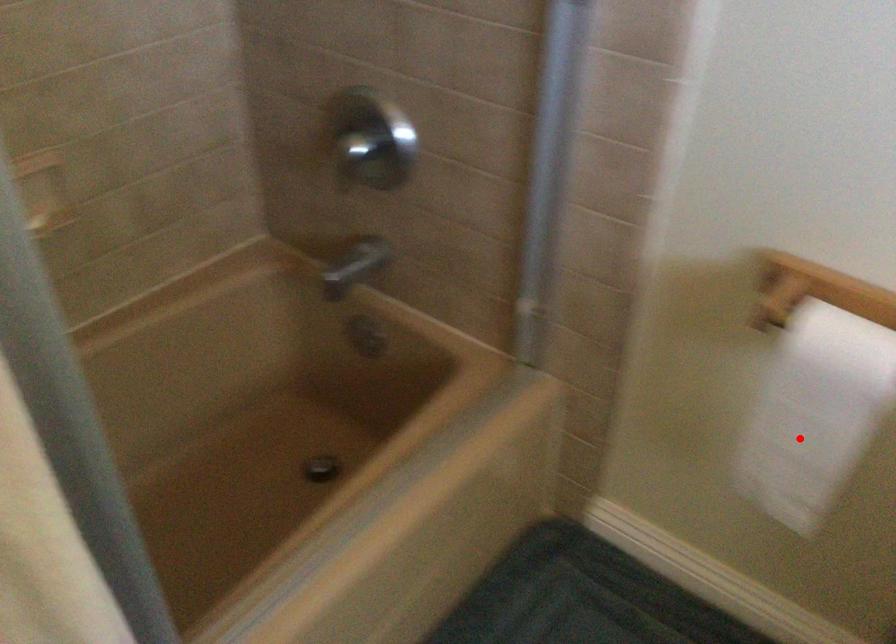
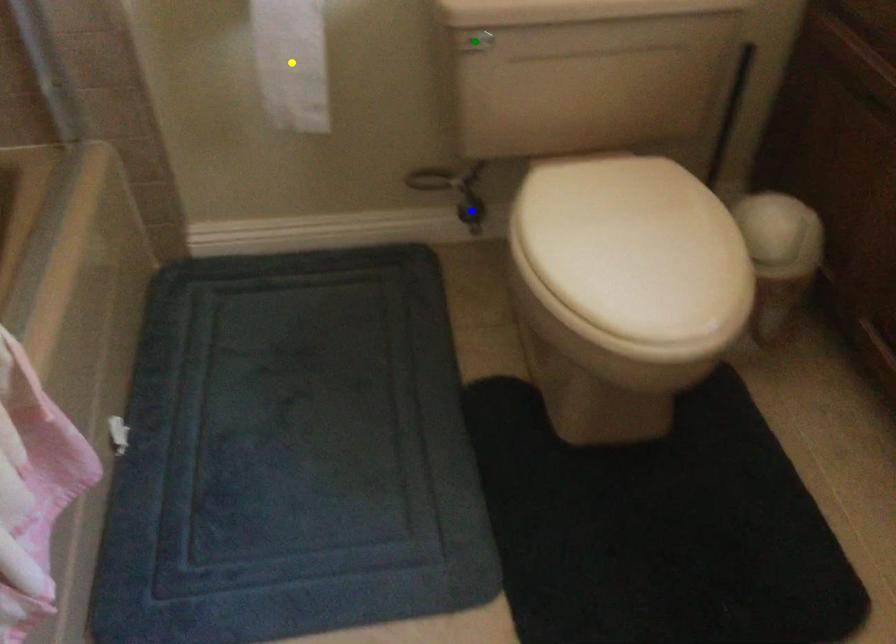
Question: I am providing you with two images of the same scene from different viewpoints. A red point is marked on the first image. You are given multiple points on the second image. Which spot in image 2 lines up with the point in image 1?

Choices:
 (A) yellow point
 (B) blue point
 (C) green point

Answer: (A)